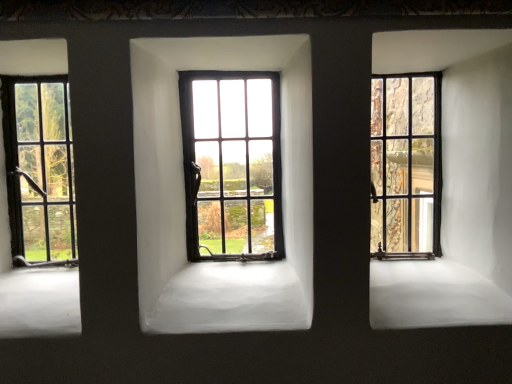
Question: Is matte black window at center, which is the 2th window from left to right, bigger than matte black window at right, positioned as the 3th window in left-to-right order?

Choices:
 (A) yes
 (B) no

Answer: (A)

Question: Can you confirm if matte black window at center, which is the 2th window from left to right, is positioned to the right of matte black window at right, positioned as the 3th window in left-to-right order?

Choices:
 (A) no
 (B) yes

Answer: (A)

Question: Is matte black window at center, arranged as the second window when viewed from the right, positioned behind matte black window at right, marked as the 1th window in a right-to-left arrangement?

Choices:
 (A) yes
 (B) no

Answer: (B)

Question: Does matte black window at center, which is the 2th window from left to right, turn towards matte black window at right, marked as the 1th window in a right-to-left arrangement?

Choices:
 (A) no
 (B) yes

Answer: (A)

Question: Would you say matte black window at right, positioned as the 3th window in left-to-right order, is part of matte black window at center, arranged as the second window when viewed from the right,'s contents?

Choices:
 (A) no
 (B) yes

Answer: (A)

Question: Considering the positions of matte black window at left, the 1th window in the left-to-right sequence, and matte black window at center, arranged as the second window when viewed from the right, in the image, is matte black window at left, the 1th window in the left-to-right sequence, taller or shorter than matte black window at center, arranged as the second window when viewed from the right,?

Choices:
 (A) short
 (B) tall

Answer: (A)

Question: Is matte black window at left, the 1th window in the left-to-right sequence, wider or thinner than matte black window at center, arranged as the second window when viewed from the right?

Choices:
 (A) thin
 (B) wide

Answer: (A)

Question: From a real-world perspective, is matte black window at left, the 1th window in the left-to-right sequence, positioned above or below matte black window at center, arranged as the second window when viewed from the right?

Choices:
 (A) below
 (B) above

Answer: (A)

Question: Considering the positions of point (49, 168) and point (238, 193), is point (49, 168) closer or farther from the camera than point (238, 193)?

Choices:
 (A) closer
 (B) farther

Answer: (A)

Question: Is point (433, 221) positioned closer to the camera than point (36, 119)?

Choices:
 (A) farther
 (B) closer

Answer: (A)

Question: Looking at their shapes, would you say matte black window at right, marked as the 1th window in a right-to-left arrangement, is wider or thinner than matte black window at left, the 1th window in the left-to-right sequence?

Choices:
 (A) thin
 (B) wide

Answer: (A)

Question: From a real-world perspective, is matte black window at right, marked as the 1th window in a right-to-left arrangement, physically located above or below matte black window at left, the third window viewed from the right?

Choices:
 (A) above
 (B) below

Answer: (A)

Question: From the image's perspective, is matte black window at right, marked as the 1th window in a right-to-left arrangement, located above or below matte black window at left, the 1th window in the left-to-right sequence?

Choices:
 (A) below
 (B) above

Answer: (B)

Question: Would you say matte black window at left, the third window viewed from the right, is to the left or to the right of matte black window at right, marked as the 1th window in a right-to-left arrangement, in the picture?

Choices:
 (A) right
 (B) left

Answer: (B)

Question: From a real-world perspective, is matte black window at left, the 1th window in the left-to-right sequence, physically located above or below matte black window at right, marked as the 1th window in a right-to-left arrangement?

Choices:
 (A) above
 (B) below

Answer: (B)